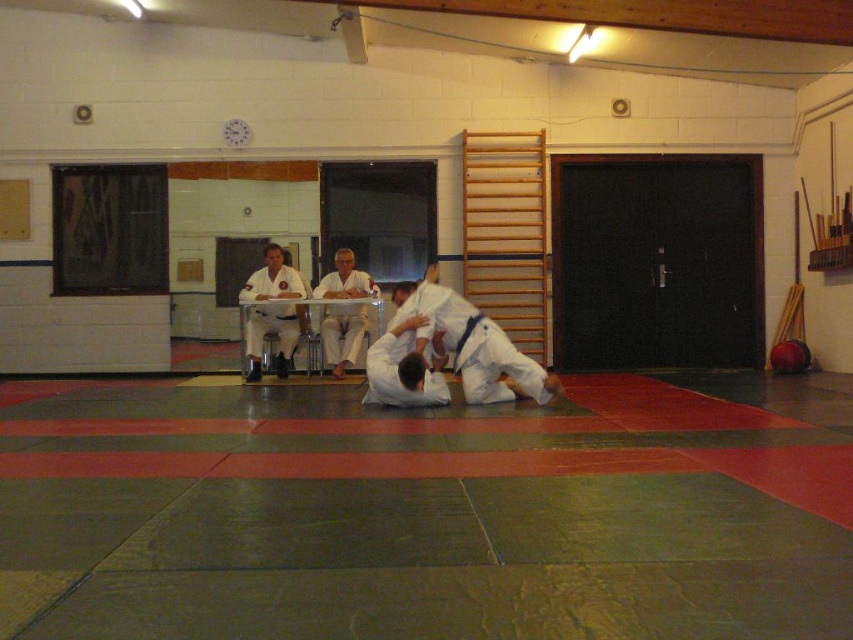
How much distance is there between white karate gi at center and white fabric pants at center?

2.04 meters

Between white karate gi at center and white fabric pants at center, which one has more height?

With more height is white fabric pants at center.

What are the coordinates of `white karate gi at center` in the screenshot? It's located at (471, 346).

Who is positioned more to the left, white karate gi at center or white karate uniform at center?

white karate uniform at center is more to the left.

Does white karate gi at center have a greater height compared to white karate uniform at center?

In fact, white karate gi at center may be shorter than white karate uniform at center.

Describe the element at coordinates (471, 346) in the screenshot. This screenshot has height=640, width=853. I see `white karate gi at center` at that location.

Where is `white karate gi at center`? Image resolution: width=853 pixels, height=640 pixels. white karate gi at center is located at coordinates (471, 346).

Does white karate uniform at center have a lesser height compared to white fabric pants at center?

No.

The image size is (853, 640). What do you see at coordinates (271, 333) in the screenshot?
I see `white karate uniform at center` at bounding box center [271, 333].

This screenshot has width=853, height=640. In order to click on white karate uniform at center in this screenshot , I will do `click(271, 333)`.